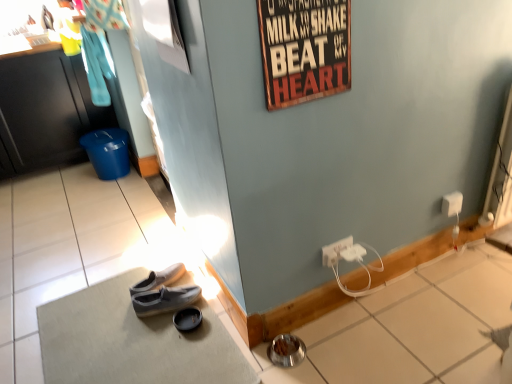
Question: Is white plastic power outlet at lower right, which is the 3th power outlet in back-to-front order, closer to camera compared to wooden signboard at upper center?

Choices:
 (A) no
 (B) yes

Answer: (A)

Question: Is white plastic power outlet at lower right, the 1th power outlet in the front-to-back sequence, directly adjacent to wooden signboard at upper center?

Choices:
 (A) no
 (B) yes

Answer: (A)

Question: From a real-world perspective, does white plastic power outlet at lower right, the first power outlet ordered from the bottom, sit lower than wooden signboard at upper center?

Choices:
 (A) yes
 (B) no

Answer: (A)

Question: Is white plastic power outlet at lower right, arranged as the second power outlet when viewed from the left, smaller than wooden signboard at upper center?

Choices:
 (A) no
 (B) yes

Answer: (B)

Question: From the image's perspective, is white plastic power outlet at lower right, which is the 3th power outlet in back-to-front order, over wooden signboard at upper center?

Choices:
 (A) yes
 (B) no

Answer: (B)

Question: Would you say white plastic power outlet at lower right, marked as the 2th power outlet in a front-to-back arrangement, is inside or outside black matte cabinet at left?

Choices:
 (A) outside
 (B) inside

Answer: (A)

Question: Considering the positions of white plastic power outlet at lower right, positioned as the second power outlet in back-to-front order, and black matte cabinet at left in the image, is white plastic power outlet at lower right, positioned as the second power outlet in back-to-front order, taller or shorter than black matte cabinet at left?

Choices:
 (A) tall
 (B) short

Answer: (B)

Question: Visually, is white plastic power outlet at lower right, the first power outlet positioned from the left, positioned to the left or to the right of black matte cabinet at left?

Choices:
 (A) right
 (B) left

Answer: (A)

Question: Is point (326, 264) positioned closer to the camera than point (38, 122)?

Choices:
 (A) closer
 (B) farther

Answer: (A)

Question: From a real-world perspective, is white plastic power outlet at lower right, marked as the 3th power outlet in a right-to-left arrangement, above or below white plastic power outlet at lower right, the 1th power outlet in the front-to-back sequence?

Choices:
 (A) above
 (B) below

Answer: (A)

Question: Looking at the image, does white plastic power outlet at lower right, positioned as the second power outlet in back-to-front order, seem bigger or smaller compared to white plastic power outlet at lower right, the 1th power outlet in the front-to-back sequence?

Choices:
 (A) small
 (B) big

Answer: (A)

Question: Looking at their shapes, would you say white plastic power outlet at lower right, marked as the 2th power outlet in a front-to-back arrangement, is wider or thinner than white plastic power outlet at lower right, which is the 3th power outlet from top to bottom?

Choices:
 (A) thin
 (B) wide

Answer: (A)

Question: From the image's perspective, is white plastic power outlet at lower right, which appears as the second power outlet when ordered from the bottom, above or below white plastic power outlet at lower right, which is the 3th power outlet in back-to-front order?

Choices:
 (A) above
 (B) below

Answer: (A)

Question: Choose the correct answer: Is white plastic power outlet at lower right, the first power outlet ordered from the bottom, inside white plastic power outlet at lower right, the first power outlet positioned from the left, or outside it?

Choices:
 (A) inside
 (B) outside

Answer: (B)

Question: In the image, is white plastic power outlet at lower right, the first power outlet ordered from the bottom, positioned in front of or behind white plastic power outlet at lower right, marked as the 2th power outlet in a front-to-back arrangement?

Choices:
 (A) front
 (B) behind

Answer: (A)